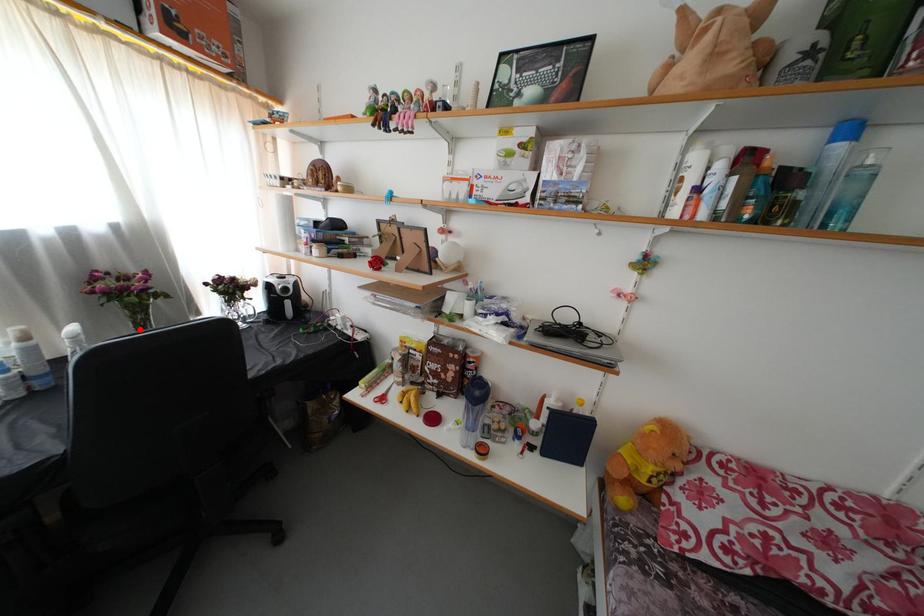
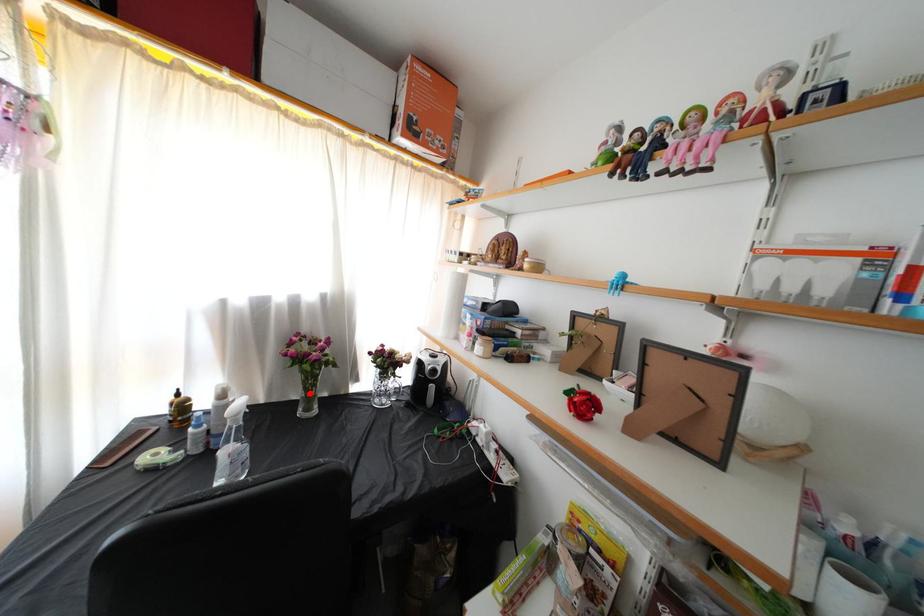
I am providing you with two images of the same scene from different viewpoints. A red point is marked on the first image and another point is marked on the second image. Is the red point in image1 aligned with the point shown in image2?

Yes